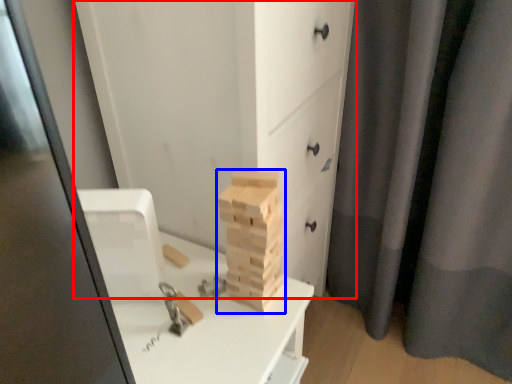
Question: Among these objects, which one is nearest to the camera, chest of drawers (highlighted by a red box) or drawer (highlighted by a blue box)?

Choices:
 (A) chest of drawers
 (B) drawer

Answer: (A)